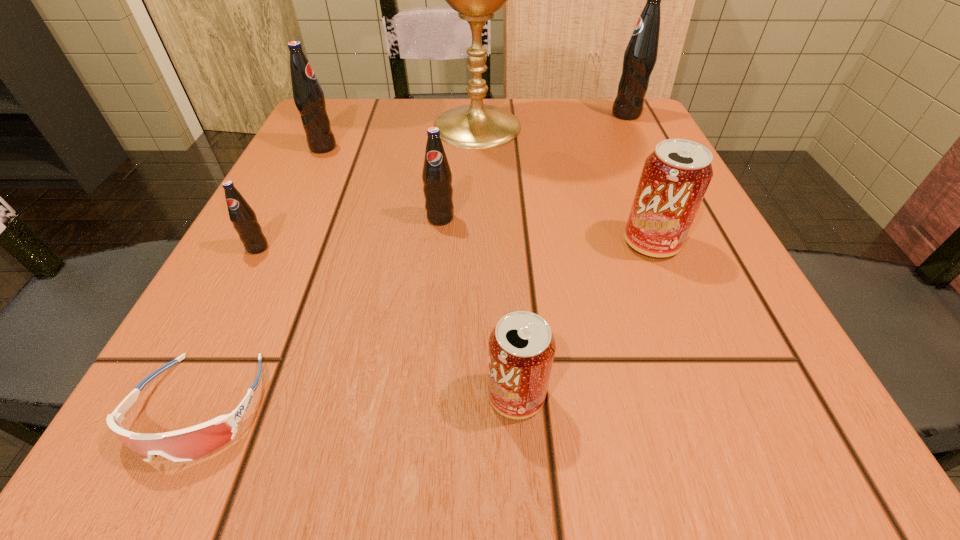
Where is `trophy cup`? This screenshot has height=540, width=960. trophy cup is located at coordinates (475, 126).

Image resolution: width=960 pixels, height=540 pixels. In order to click on the tallest soda can in this screenshot , I will do `click(640, 55)`.

Identify the location of the seventh shortest object. (640, 55).

What are the coordinates of `the second farthest black pop` in the screenshot? It's located at (308, 95).

At what (x,y) coordinates should I click in order to perform the action: click on the third tallest object. Please return your answer as a coordinate pair (x, y). Looking at the image, I should click on (308, 95).

Identify the location of the third biggest black pop. This screenshot has width=960, height=540. (437, 177).

Locate an element on the screen. This screenshot has width=960, height=540. the third soda can from left to right is located at coordinates (437, 177).

Locate an element on the screen. This screenshot has height=540, width=960. the farther red soda can is located at coordinates (675, 177).

Image resolution: width=960 pixels, height=540 pixels. I want to click on the right red soda can, so 675,177.

What are the coordinates of `the nearest black pop` in the screenshot? It's located at (243, 217).